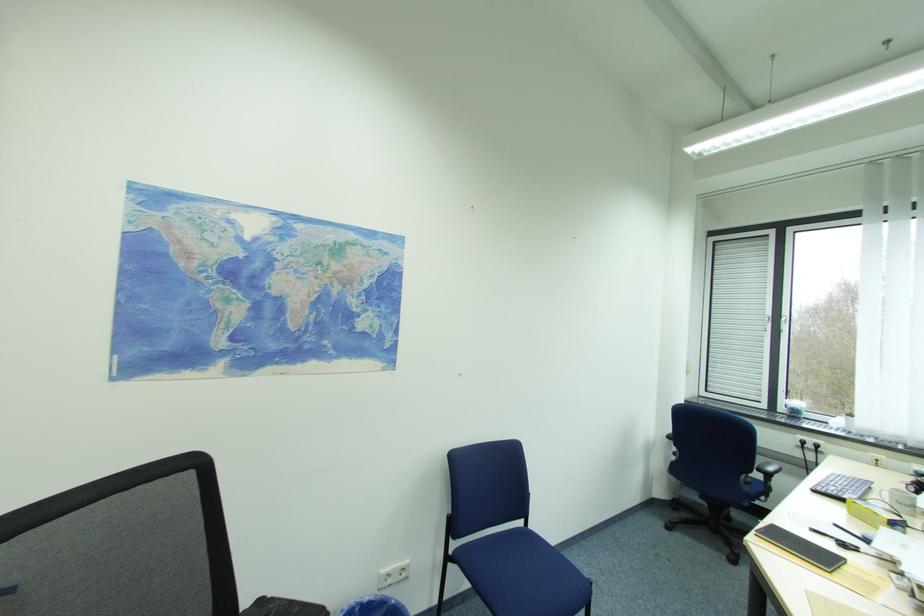
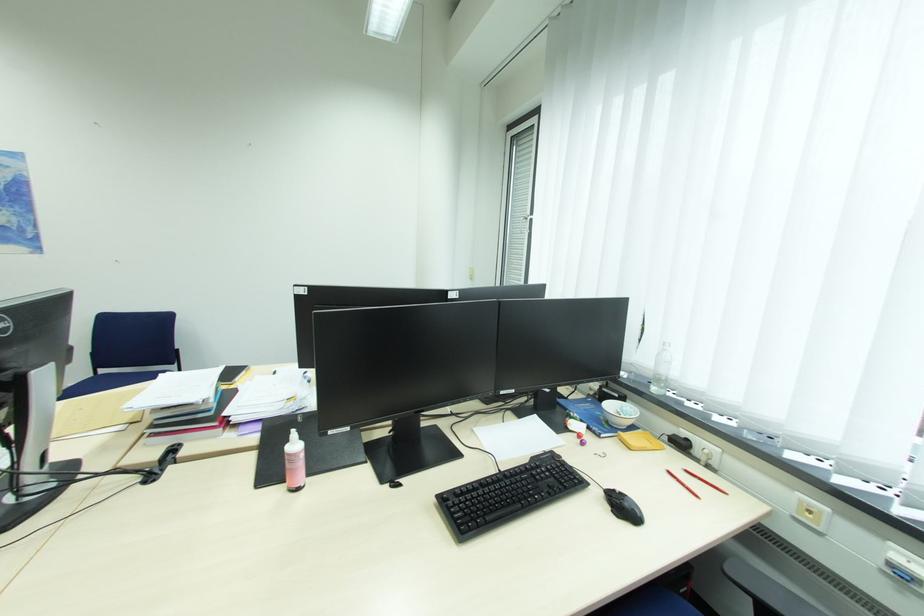
Question: In a continuous first-person perspective shot, in which direction is the camera moving?

Choices:
 (A) Left
 (B) Right
 (C) Forward
 (D) Backward

Answer: (B)